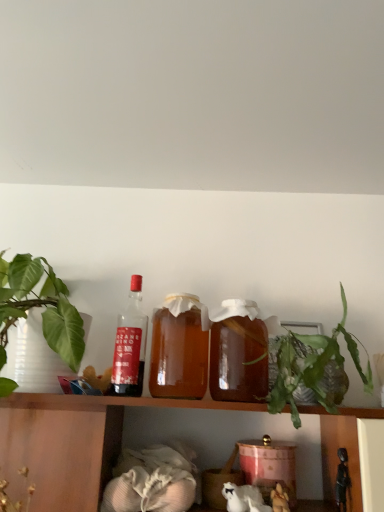
Question: Can you confirm if shiny black figurine at lower right, arranged as the 2th toy when viewed from the left, is thinner than translucent glass bottle at center, the 1th bottle positioned from the right?

Choices:
 (A) yes
 (B) no

Answer: (A)

Question: Can you confirm if shiny black figurine at lower right, arranged as the 2th toy when viewed from the left, is taller than translucent glass bottle at center, the 1th bottle positioned from the right?

Choices:
 (A) yes
 (B) no

Answer: (B)

Question: Is shiny black figurine at lower right, which is the first toy from right to left, turned away from translucent glass bottle at center, the 1th bottle positioned from the right?

Choices:
 (A) yes
 (B) no

Answer: (B)

Question: From the image's perspective, would you say shiny black figurine at lower right, which is the first toy from right to left, is positioned over translucent glass bottle at center, the 1th bottle positioned from the right?

Choices:
 (A) yes
 (B) no

Answer: (B)

Question: Can translucent glass bottle at center, positioned as the 3th bottle in left-to-right order, be found inside shiny black figurine at lower right, arranged as the 2th toy when viewed from the left?

Choices:
 (A) no
 (B) yes

Answer: (A)

Question: Does shiny black figurine at lower right, which is the first toy from right to left, have a smaller size compared to translucent glass bottle at center, the 1th bottle positioned from the right?

Choices:
 (A) yes
 (B) no

Answer: (A)

Question: From a real-world perspective, is translucent glass bottle at center, the 1th bottle positioned from the right, positioned under fluffy white stuffed animal at lower center, the first toy when ordered from left to right, based on gravity?

Choices:
 (A) no
 (B) yes

Answer: (A)

Question: Can you see translucent glass bottle at center, positioned as the 3th bottle in left-to-right order, touching fluffy white stuffed animal at lower center, acting as the 2th toy starting from the right?

Choices:
 (A) yes
 (B) no

Answer: (B)

Question: Is translucent glass bottle at center, the 1th bottle positioned from the right, behind fluffy white stuffed animal at lower center, the first toy when ordered from left to right?

Choices:
 (A) yes
 (B) no

Answer: (B)

Question: Is translucent glass bottle at center, the 1th bottle positioned from the right, turned away from fluffy white stuffed animal at lower center, acting as the 2th toy starting from the right?

Choices:
 (A) no
 (B) yes

Answer: (A)

Question: Does translucent glass bottle at center, positioned as the 3th bottle in left-to-right order, have a lesser width compared to fluffy white stuffed animal at lower center, the first toy when ordered from left to right?

Choices:
 (A) no
 (B) yes

Answer: (A)

Question: Is translucent glass bottle at center, positioned as the 3th bottle in left-to-right order, bigger than fluffy white stuffed animal at lower center, the first toy when ordered from left to right?

Choices:
 (A) no
 (B) yes

Answer: (B)

Question: Is translucent glass bottle at center, positioned as the 3th bottle in left-to-right order, thinner than shiny black figurine at lower right, arranged as the 2th toy when viewed from the left?

Choices:
 (A) yes
 (B) no

Answer: (B)